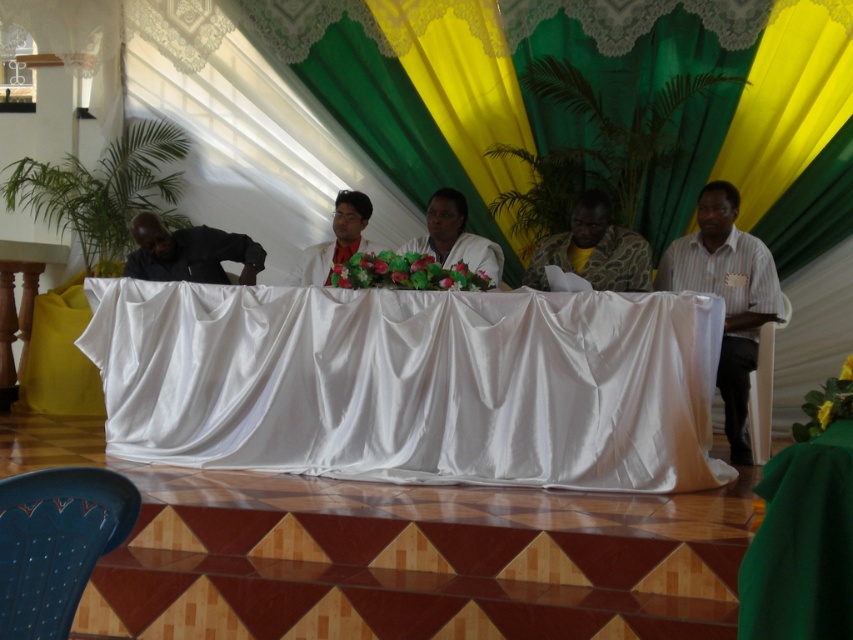
Question: Considering the relative positions of snake skin shirt at center and black matte shirt at left in the image provided, where is snake skin shirt at center located with respect to black matte shirt at left?

Choices:
 (A) below
 (B) above

Answer: (B)

Question: Among these objects, which one is nearest to the camera?

Choices:
 (A) white fabric at center
 (B) black matte shirt at left
 (C) matte white shirt at center

Answer: (A)

Question: Which object is positioned farthest from the snake skin shirt at center?

Choices:
 (A) white fabric at center
 (B) white satin table at center
 (C) black matte shirt at left
 (D) striped cotton shirt at right

Answer: (C)

Question: Observing the image, what is the correct spatial positioning of black matte shirt at left in reference to matte white shirt at center?

Choices:
 (A) left
 (B) right

Answer: (A)

Question: Which point is closer to the camera taking this photo?

Choices:
 (A) (345, 218)
 (B) (799, 602)
 (C) (553, 234)
 (D) (752, 316)

Answer: (B)

Question: Is black matte shirt at left bigger than matte white shirt at center?

Choices:
 (A) yes
 (B) no

Answer: (B)